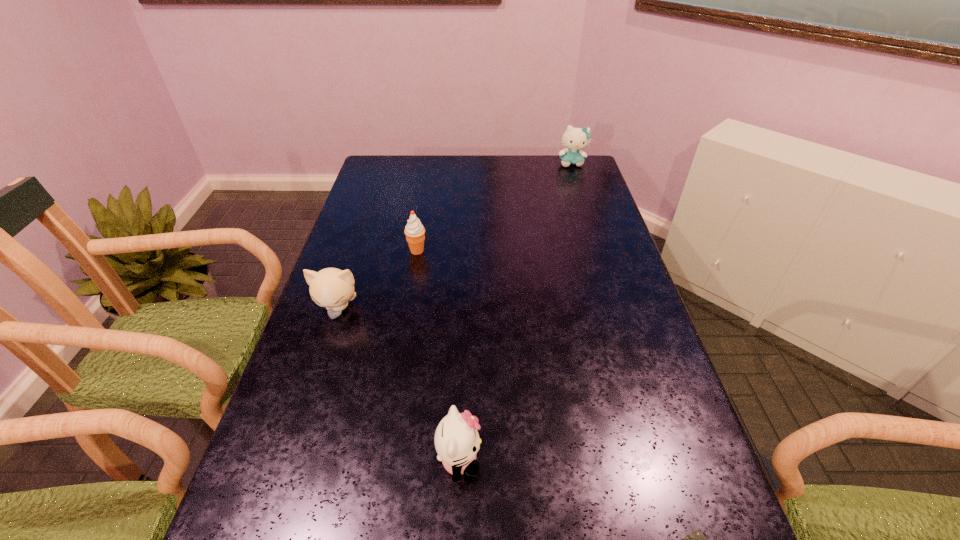
Locate an element on the screen. object that is the closest one to the second kitten from right to left is located at coordinates (696, 539).

Where is `kitten that stands as the closest to the rightmost kitten`? This screenshot has width=960, height=540. kitten that stands as the closest to the rightmost kitten is located at coordinates (332, 288).

Locate an element on the screen. Image resolution: width=960 pixels, height=540 pixels. the second closest kitten to the farthest object is located at coordinates (457, 441).